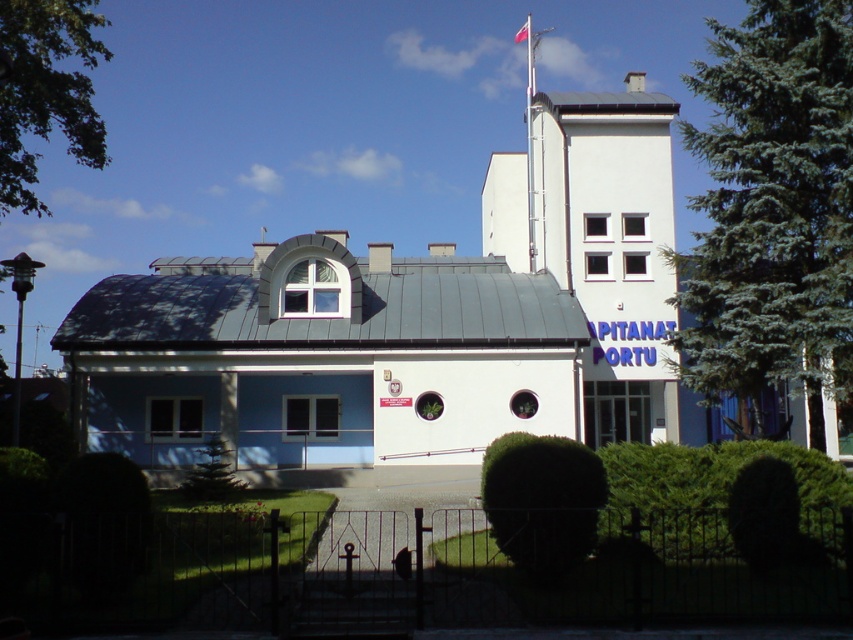
You are standing in front of a two story building with a modern architectural style. You see a point labeled as point (x=410, y=321). What does this point represent?

The point (x=410, y=321) represents the blue matte building at center.